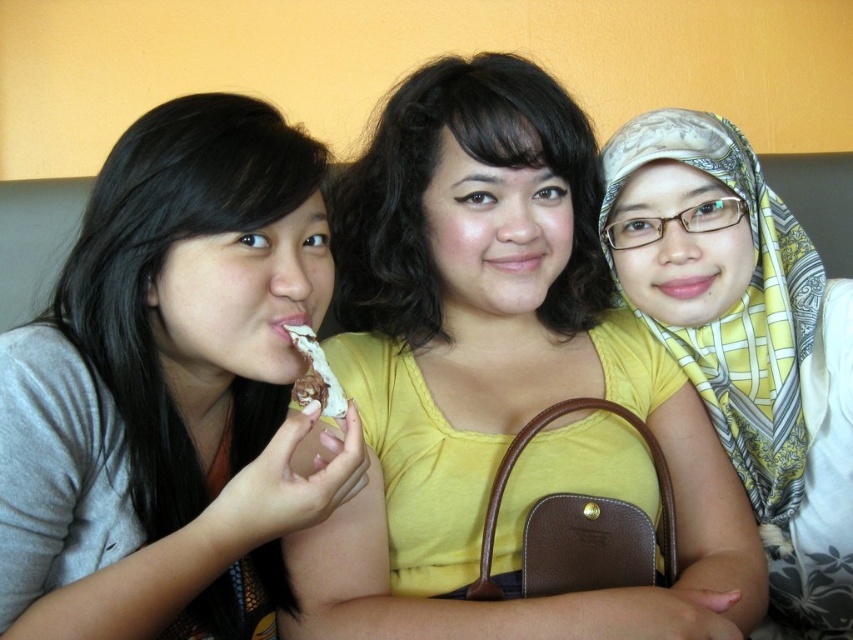
In the scene shown: You are a photographer trying to capture a candid shot of the matte gray shirt at left and the chocolate frosted cake at center. Since you want to focus on the cake, which object should you position closer to the camera to ensure it is in sharp focus?

To ensure the chocolate frosted cake at center is in sharp focus, you should position the matte gray shirt at left further away from the camera so the chocolate frosted cake at center is closer to the camera.

You are taking a photo of two points in the image. The first point is at coordinate point (165, 300) and the second point is at coordinate point (315, 340). Which point is closer to the camera?

Point (165, 300) is closer to the camera than point (315, 340).